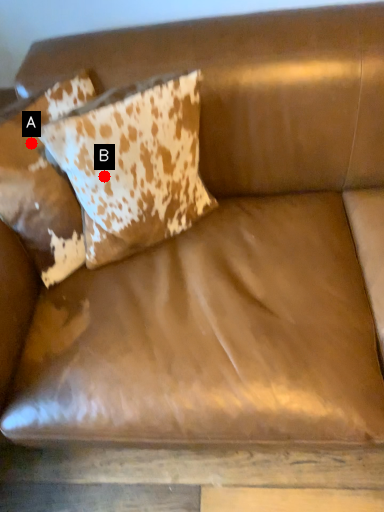
Question: Two points are circled on the image, labeled by A and B beside each circle. Which point appears farthest from the camera in this image?

Choices:
 (A) A is further
 (B) B is further

Answer: (A)